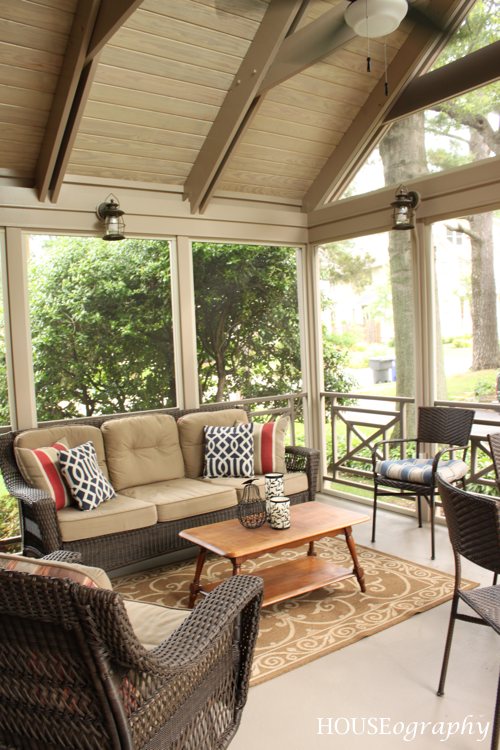
In order to click on throw pillow in this screenshot , I will do `click(93, 487)`, `click(57, 478)`, `click(225, 442)`, `click(270, 448)`.